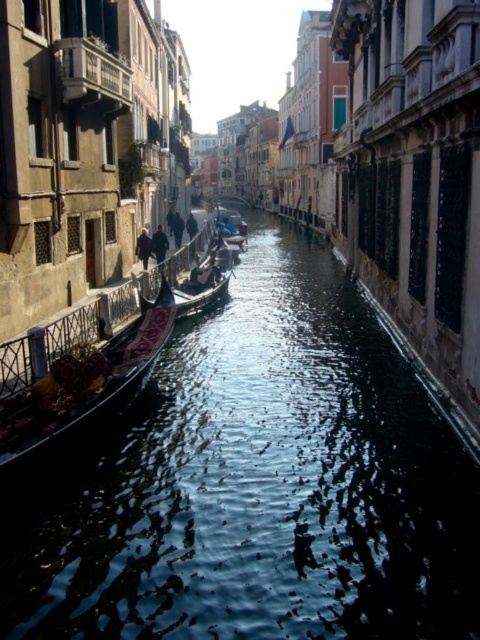
You are a tourist standing on the canal bridge. You see the clear water at center and the black polished gondola at left. Which one do you think covers a larger area in the image?

The clear water at center covers a larger area in the image than the black polished gondola at left because it is bigger.

You are a tourist standing at the edge of the canal in Venice. You notice two points marked in the scene. Which point, point (324, 589) or point (56, 397), is closer to you?

Point (324, 589) is closer to the viewer than point (56, 397).

You are a tourist standing on the bridge overlooking the canal. You want to take a photo of both the clear water at center and the black polished gondola at left. Which object should you frame first in your camera to ensure both are in the shot?

The clear water at center is taller than the black polished gondola at left, so you should frame the clear water at center first since it has a larger height and will occupy more space in the photo.